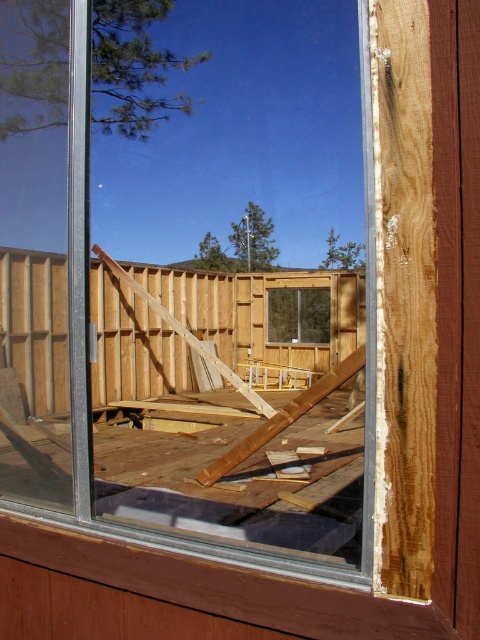
You are a drone operator trying to capture a closeup of the construction site through the window. You have two points marked on your screen, point (69,72) and point (274,317). Which point should you focus on to get the closest possible shot without moving the drone?

Point (69,72) is closer to the camera than point (274,317), so focusing on point (69,72) will give the closest possible shot without moving the drone.

You are an interior designer trying to place a large potted plant that requires a 1.2 meter wide space. You see the transparent glass window at center and the clear glass window at center. Which window can accommodate the plant?

The transparent glass window at center is bigger than clear glass window at center, so the transparent glass window at center can accommodate the large potted plant requiring 1.2 meters width.

Consider the image. You are standing in a room with a window frame. There is a point at coordinates (171,307). What object is located at that point?

The point at coordinates (171,307) corresponds to the transparent glass window at center.